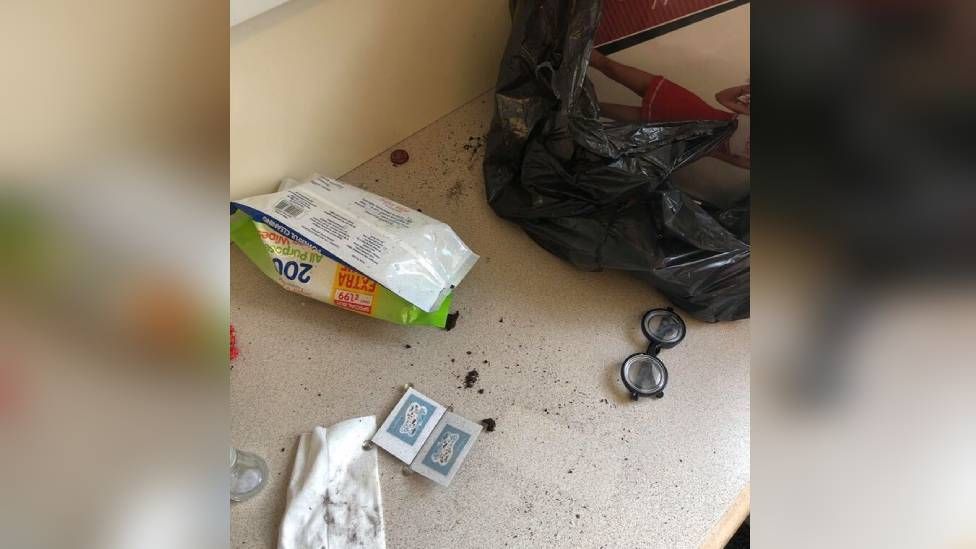
What are the coordinates of `black trash bag` in the screenshot? It's located at click(594, 226).